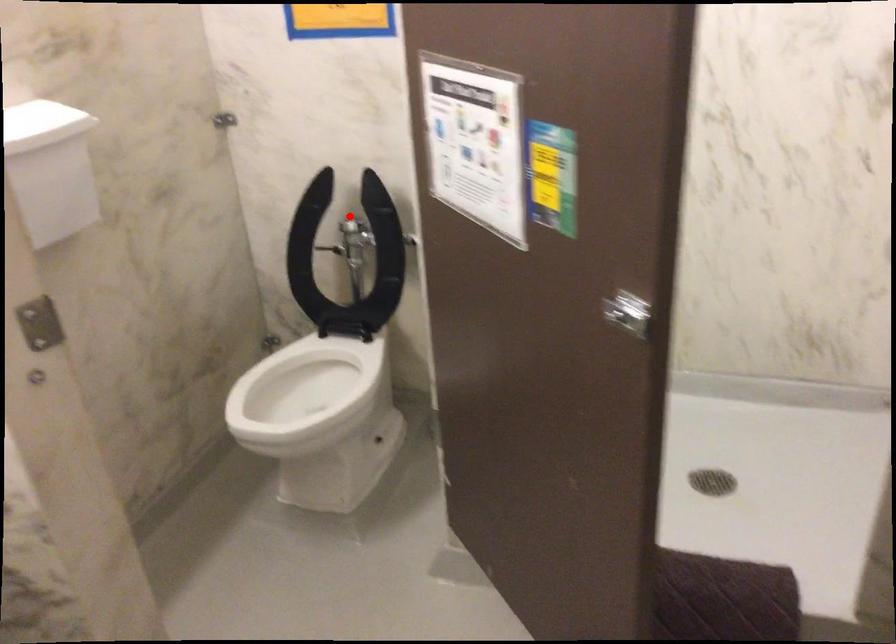
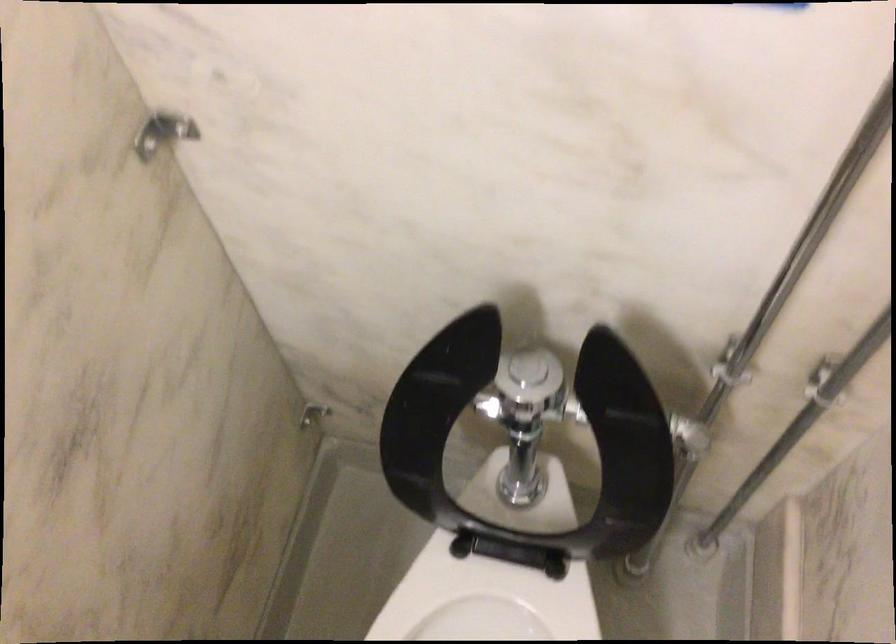
Find the pixel in the second image that matches the highlighted location in the first image.

(528, 368)